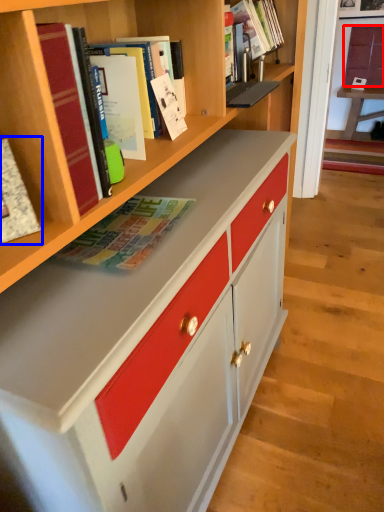
Question: Which point is further to the camera, cabinetry (highlighted by a red box) or book (highlighted by a blue box)?

Choices:
 (A) cabinetry
 (B) book

Answer: (A)